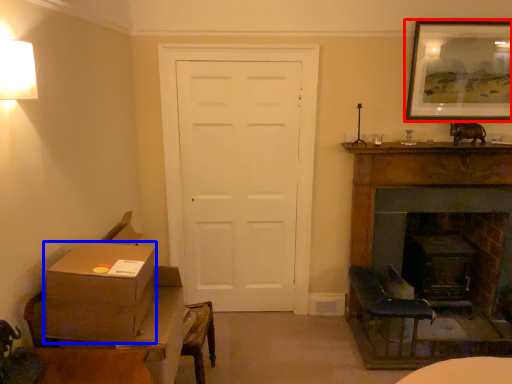
Question: Among these objects, which one is farthest to the camera, picture frame (highlighted by a red box) or box (highlighted by a blue box)?

Choices:
 (A) picture frame
 (B) box

Answer: (A)